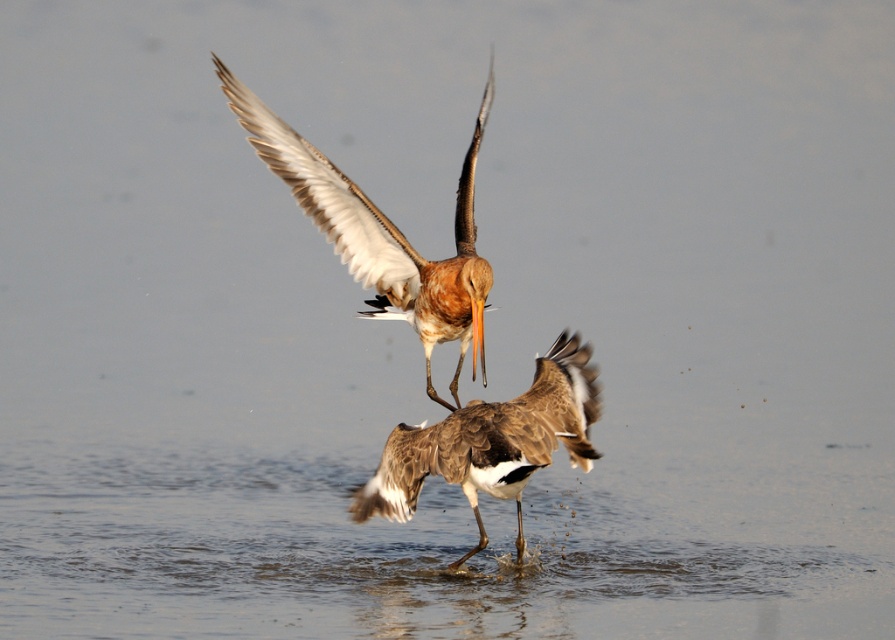
Question: Is brown feathered bird at center above brown speckled feathers at center?

Choices:
 (A) no
 (B) yes

Answer: (B)

Question: Is brown feathered bird at center behind brown speckled feathers at center?

Choices:
 (A) yes
 (B) no

Answer: (A)

Question: Which point appears closest to the camera in this image?

Choices:
 (A) (402, 496)
 (B) (324, 172)

Answer: (A)

Question: Is brown feathered bird at center further to camera compared to brown speckled feathers at center?

Choices:
 (A) no
 (B) yes

Answer: (B)

Question: Which point appears closest to the camera in this image?

Choices:
 (A) (418, 326)
 (B) (570, 401)

Answer: (B)